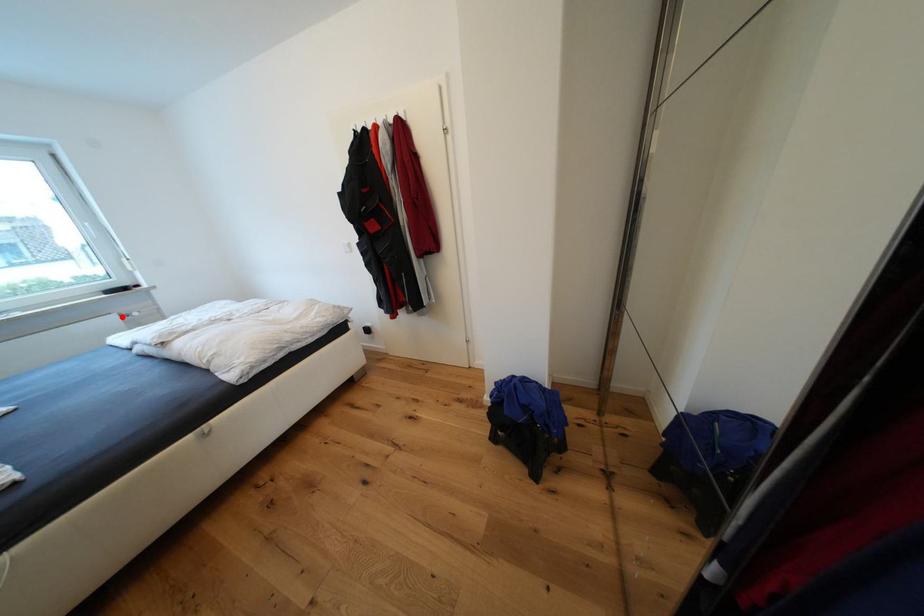
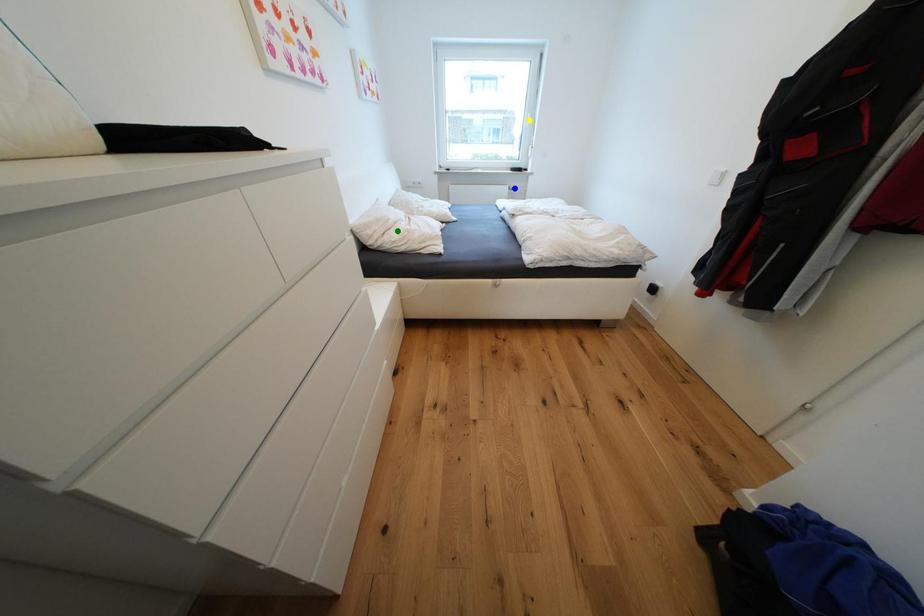
Question: I am providing you with two images of the same scene from different viewpoints. A red point is marked on the first image. You are given multiple points on the second image. Which mark in image 2 goes with the point in image 1?

Choices:
 (A) green point
 (B) yellow point
 (C) blue point

Answer: (C)